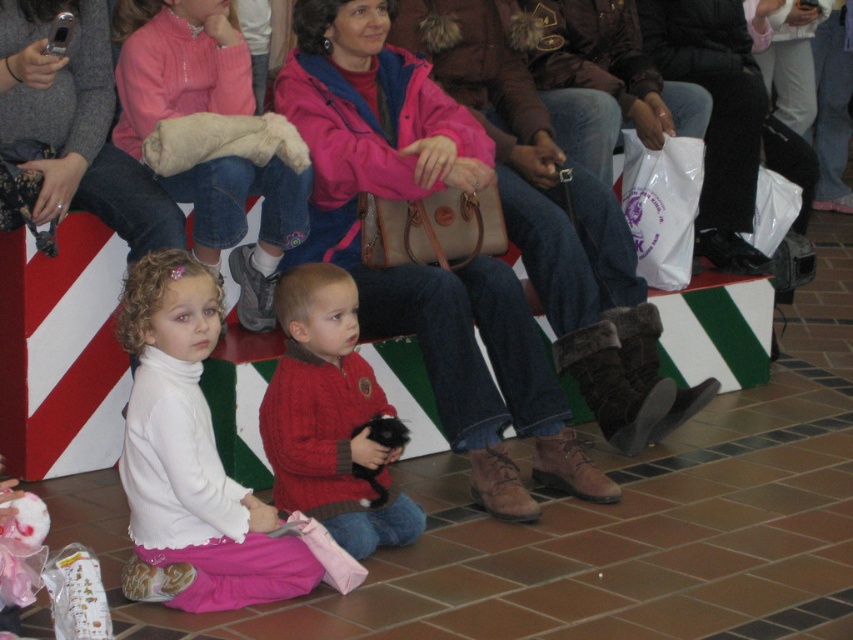
You are a photographer on the stage and need to place a new camera on the floor between the white soft turtleneck at lower left and the white plastic bag at center. Can you fit the camera there?

The white soft turtleneck at lower left is located below the white plastic bag at center, so there is space between them on the floor where the camera can be placed.

You are organizing a small event and need to place a decorative item on the stage. You have a large box that is 1 meter wide. You want to place it where the white soft turtleneck at lower left and the white plastic bag at center are currently located. Which location would allow the box to fit without overlapping either object?

The white soft turtleneck at lower left is wider than the white plastic bag at center. Since the box is 1 meter wide, placing it where the white plastic bag at center is located would be better because the bag is narrower, leaving more space around it to accommodate the box without overlapping.

You are organizing a costume party and need to decide which item to use as a prop. The white soft turtleneck at lower left and the white plastic bag at center are available. Which item is bigger and better suited for a large prop?

The white soft turtleneck at lower left is larger in size compared to the white plastic bag at center, making it better suited for a large prop.